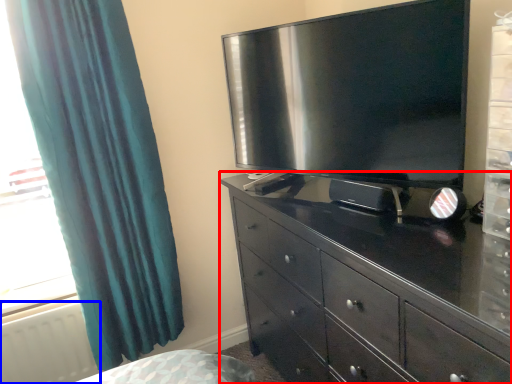
Question: Among these objects, which one is farthest to the camera, chest of drawers (highlighted by a red box) or radiator (highlighted by a blue box)?

Choices:
 (A) chest of drawers
 (B) radiator

Answer: (B)